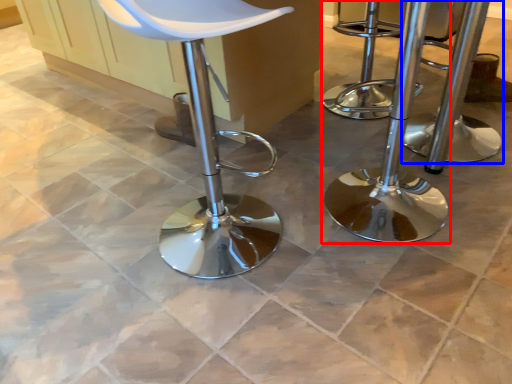
Question: Which object is closer to the camera taking this photo, stool (highlighted by a red box) or stool (highlighted by a blue box)?

Choices:
 (A) stool
 (B) stool

Answer: (A)